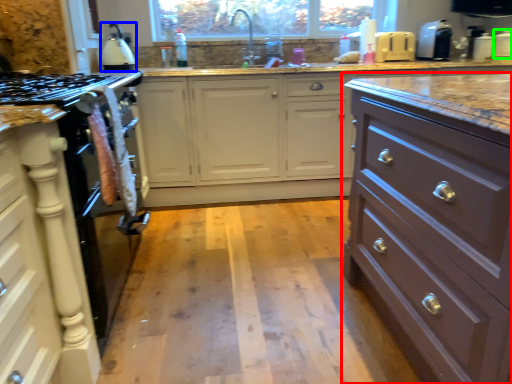
Question: Which is farther away from chest of drawers (highlighted by a red box)? kitchen appliance (highlighted by a blue box) or appliance (highlighted by a green box)?

Choices:
 (A) kitchen appliance
 (B) appliance

Answer: (B)